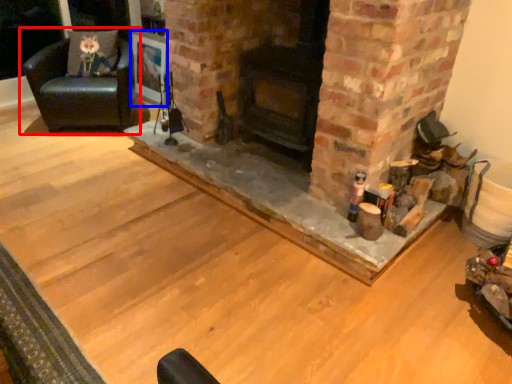
Question: Among these objects, which one is nearest to the camera, chair (highlighted by a red box) or picture frame (highlighted by a blue box)?

Choices:
 (A) chair
 (B) picture frame

Answer: (A)